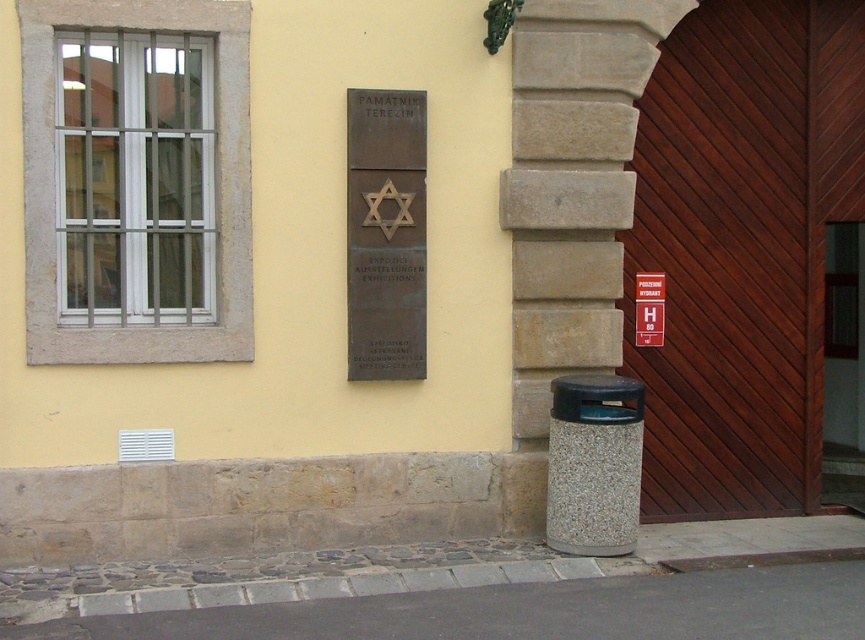
Question: Does bronze plaque at center have a lesser width compared to wooden door at center?

Choices:
 (A) yes
 (B) no

Answer: (A)

Question: Which object is positioned closest to the dark brown wood door at center right?

Choices:
 (A) wooden door at center
 (B) bronze plaque at center

Answer: (A)

Question: Among these objects, which one is nearest to the camera?

Choices:
 (A) bronze plaque at center
 (B) wooden door at center

Answer: (A)

Question: Which point appears closest to the camera in this image?

Choices:
 (A) (423, 128)
 (B) (824, 449)

Answer: (A)

Question: Does dark brown wood door at center right appear under bronze plaque at center?

Choices:
 (A) no
 (B) yes

Answer: (B)

Question: Is bronze plaque at center bigger than wooden door at center?

Choices:
 (A) yes
 (B) no

Answer: (B)